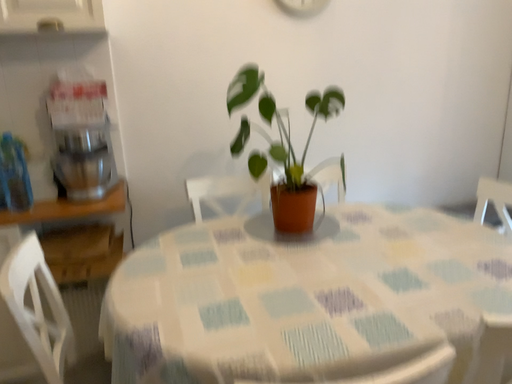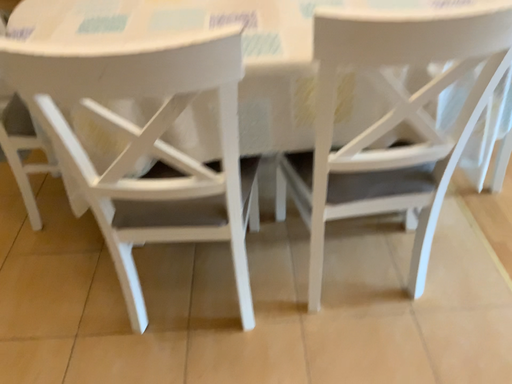
Question: How did the camera likely rotate when shooting the video?

Choices:
 (A) rotated upward
 (B) rotated downward

Answer: (B)